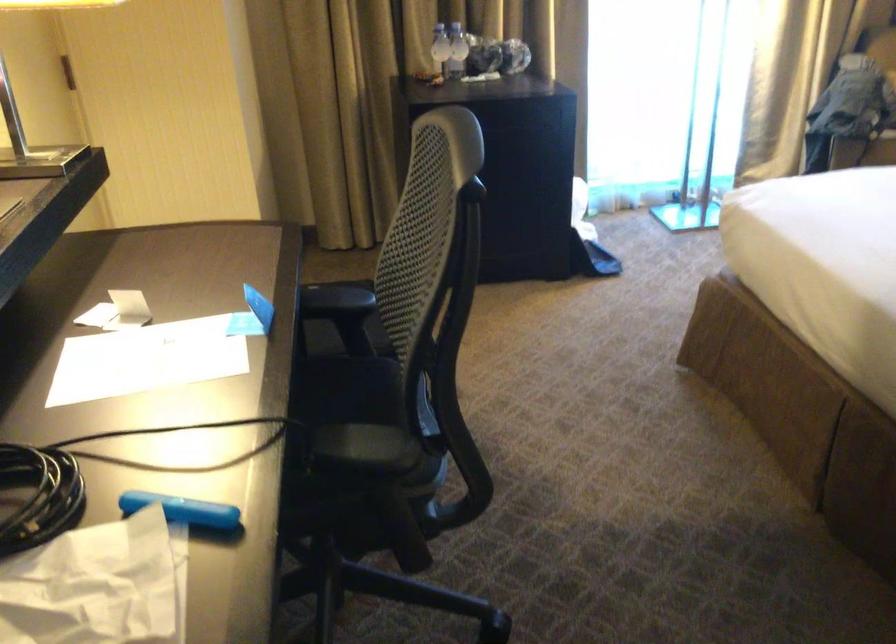
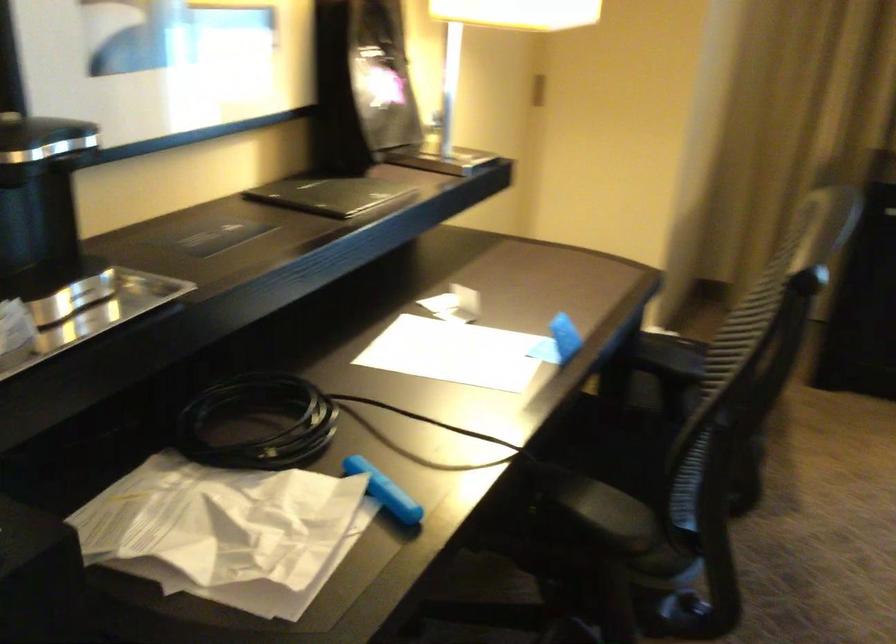
In the second image, find the point that corresponds to the point at 332,402 in the first image.

(625, 457)